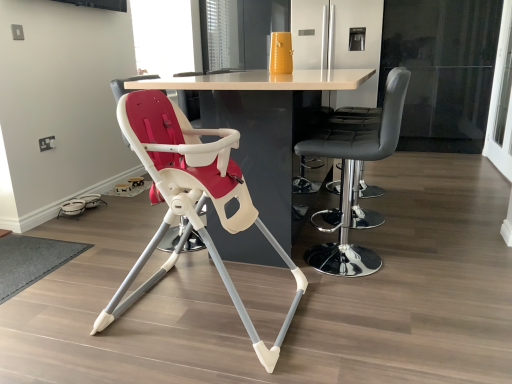
Question: Is white glossy table at center situated inside transparent glass screen door at right, marked as the second screen door in a back-to-front arrangement, or outside?

Choices:
 (A) inside
 (B) outside

Answer: (B)

Question: From the image's perspective, relative to transparent glass screen door at right, which appears as the 1th screen door when viewed from the right, is white glossy table at center above or below?

Choices:
 (A) below
 (B) above

Answer: (A)

Question: Which object is positioned farthest from the black leather bar stool at center, placed as the second chair when sorted from left to right?

Choices:
 (A) transparent glass window screen at upper center
 (B) matte white highchair at center, which appears as the second chair when viewed from the right
 (C) white glossy refrigerator at upper center, which is the 1th screen door from back to front
 (D) transparent glass screen door at right, which ranks as the second screen door in left-to-right order
 (E) white glossy table at center

Answer: (A)

Question: Based on their relative distances, which object is farther from the transparent glass window screen at upper center?

Choices:
 (A) white glossy table at center
 (B) transparent glass screen door at right, which appears as the first screen door when viewed from the front
 (C) matte white highchair at center, which appears as the second chair when viewed from the right
 (D) black leather bar stool at center, which is counted as the first chair, starting from the right
 (E) white glossy refrigerator at upper center, which is the 1th screen door from back to front

Answer: (B)